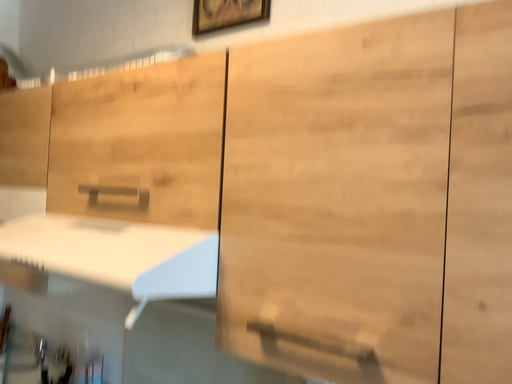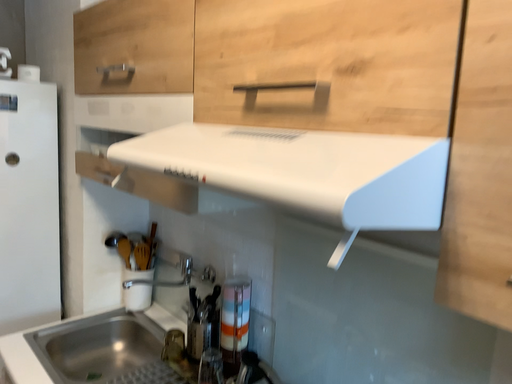
Question: How did the camera likely rotate when shooting the video?

Choices:
 (A) rotated upward
 (B) rotated downward

Answer: (B)